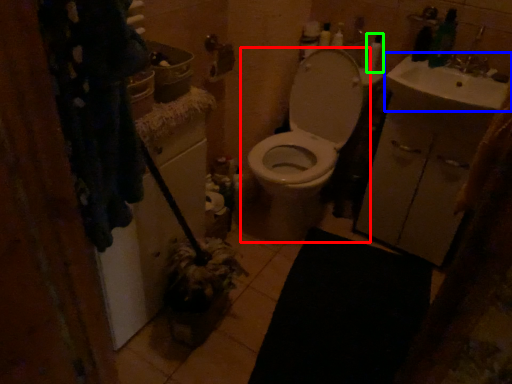
Question: Which is nearer to the toilet (highlighted by a red box)? sink (highlighted by a blue box) or toiletry (highlighted by a green box).

Choices:
 (A) sink
 (B) toiletry

Answer: (A)